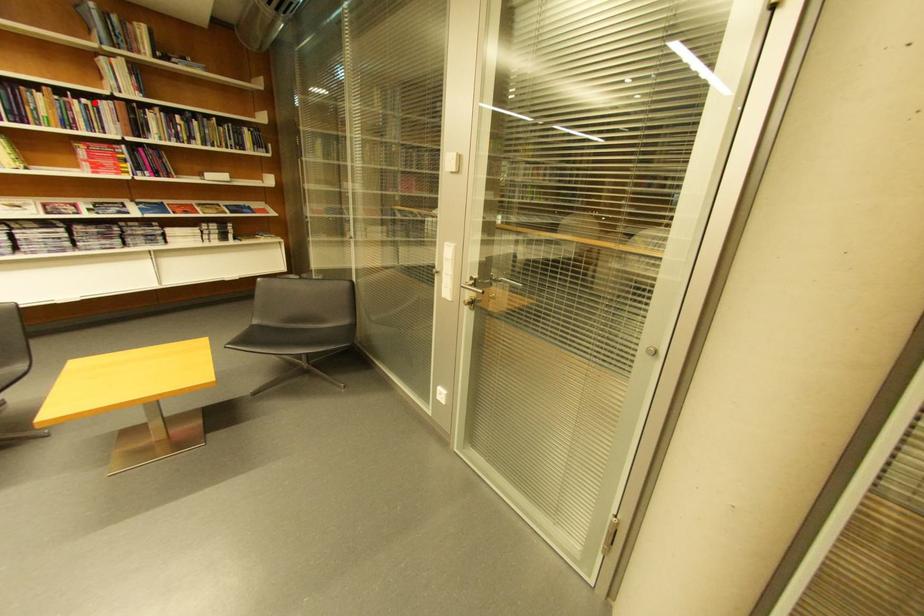
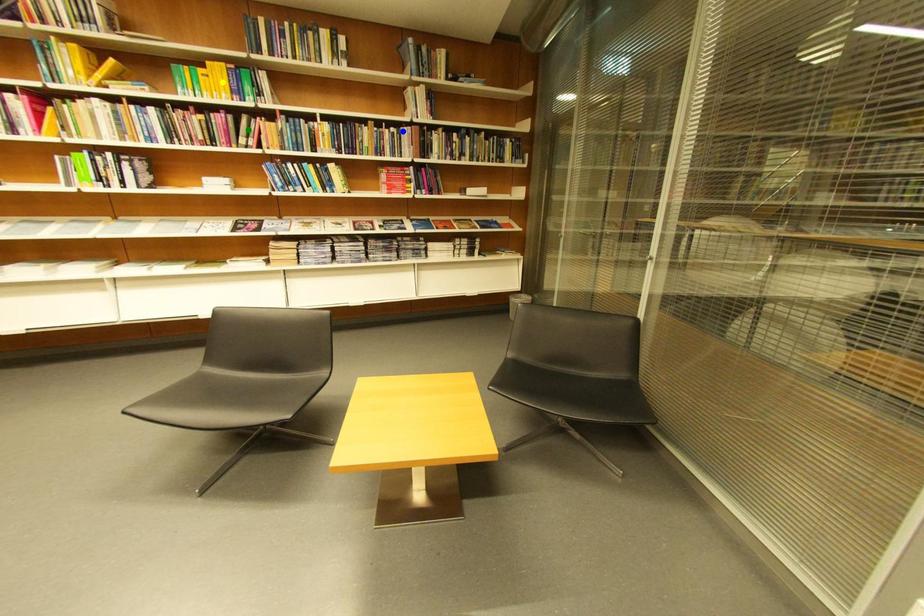
Question: I am providing you with two images of the same scene from different viewpoints. A red point is marked on the first image. You are given multiple points on the second image. In image 2, which mark is for the same physical point as the one in image 1?

Choices:
 (A) blue point
 (B) green point
 (C) yellow point

Answer: (A)